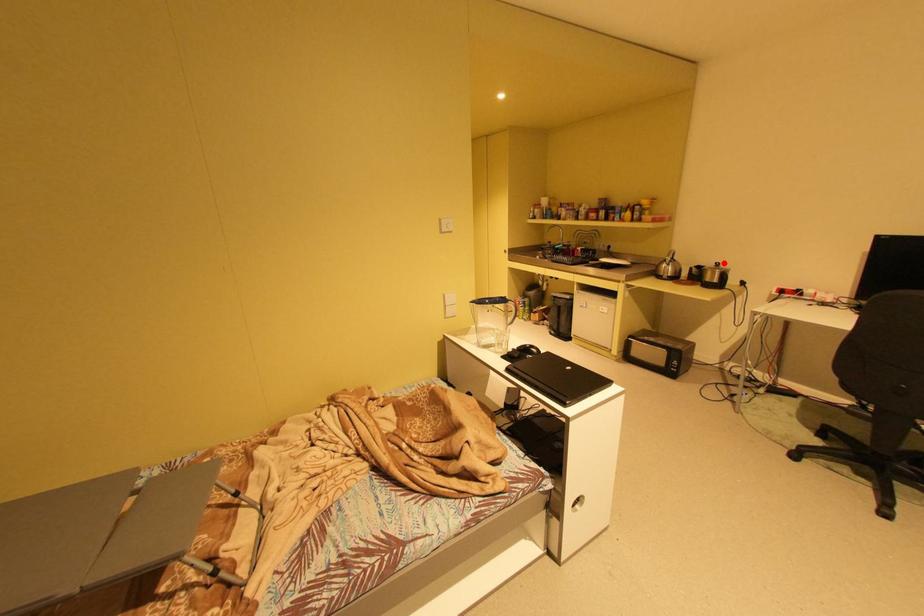
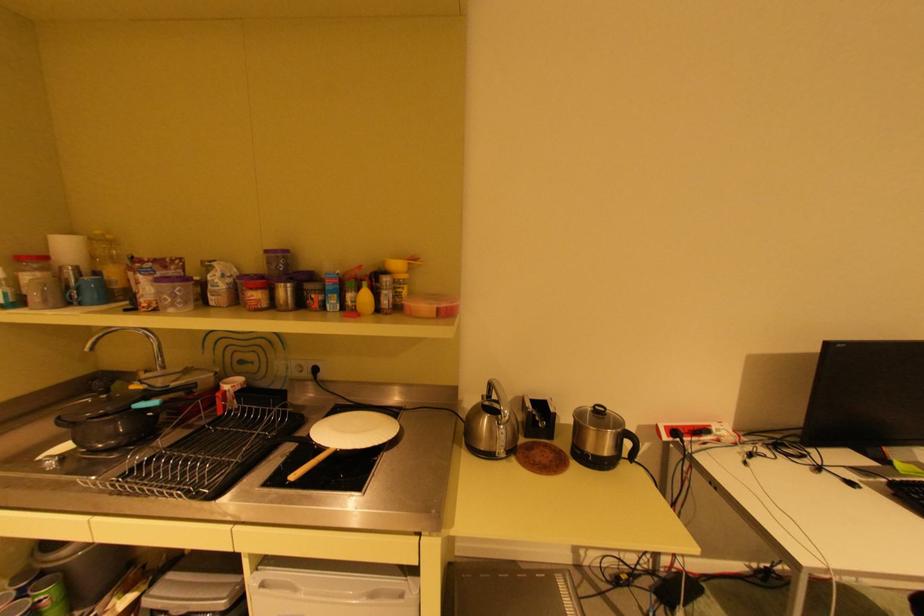
The point at the highlighted location is marked in the first image. Where is the corresponding point in the second image?

(602, 407)